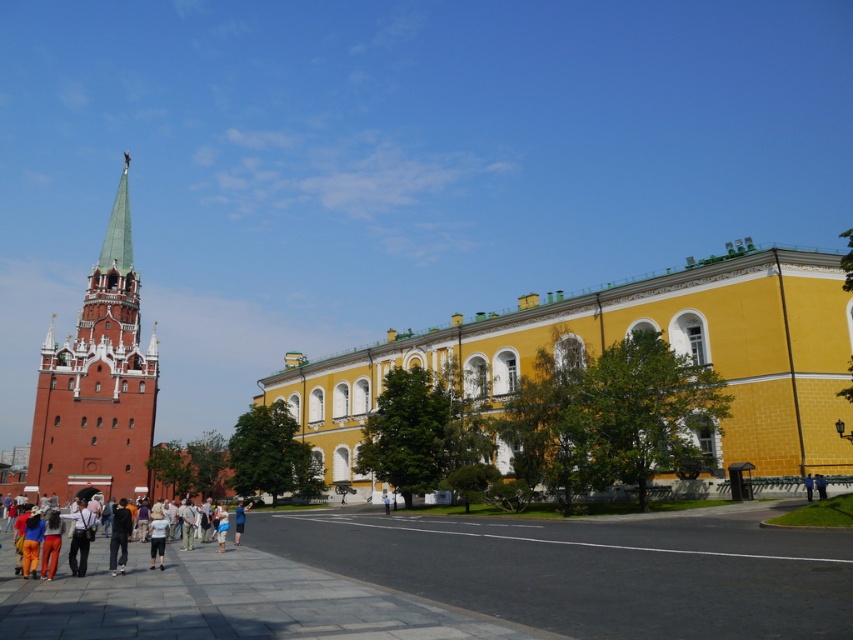
You are a tourist standing in the historical square and see the multicolored clothing at center and the blue denim jeans at center. Which item is shorter in height?

The multicolored clothing at center is not as tall as blue denim jeans at center, so the multicolored clothing at center is shorter in height.

You are a tourist visiting the historical square in Moscow. You notice two items at the center of the scene. Which item is smaller in size between the multicolored clothing at center and the blue denim jeans at center?

The multicolored clothing at center has a smaller size compared to the blue denim jeans at center, so the multicolored clothing at center is smaller.

You are a tourist standing at the entrance of the square and see the gray concrete plaza at lower left and the multicolored clothing at center. Which object is located to the right of the other?

The gray concrete plaza at lower left is to the right of multicolored clothing at center, so the plaza is positioned to the right side of the clothing.